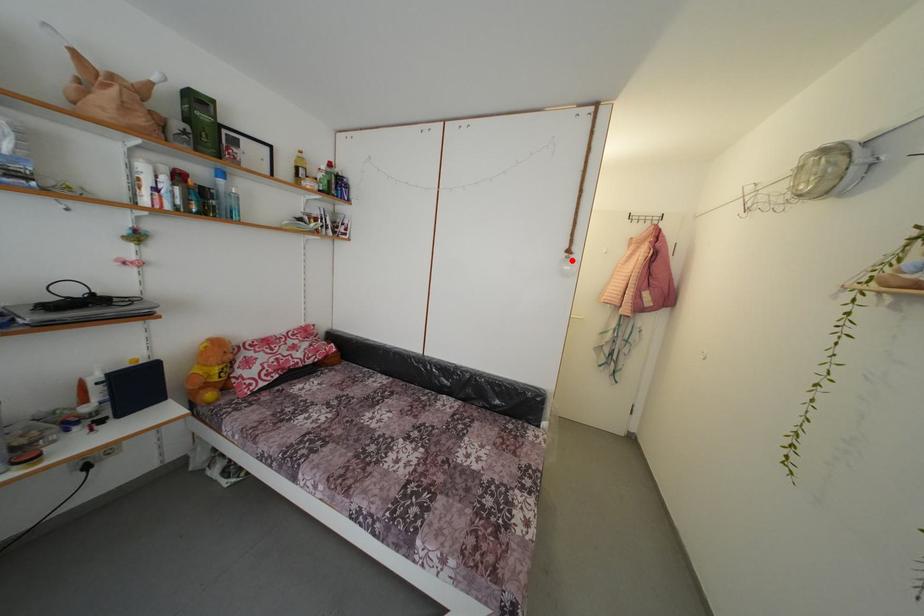
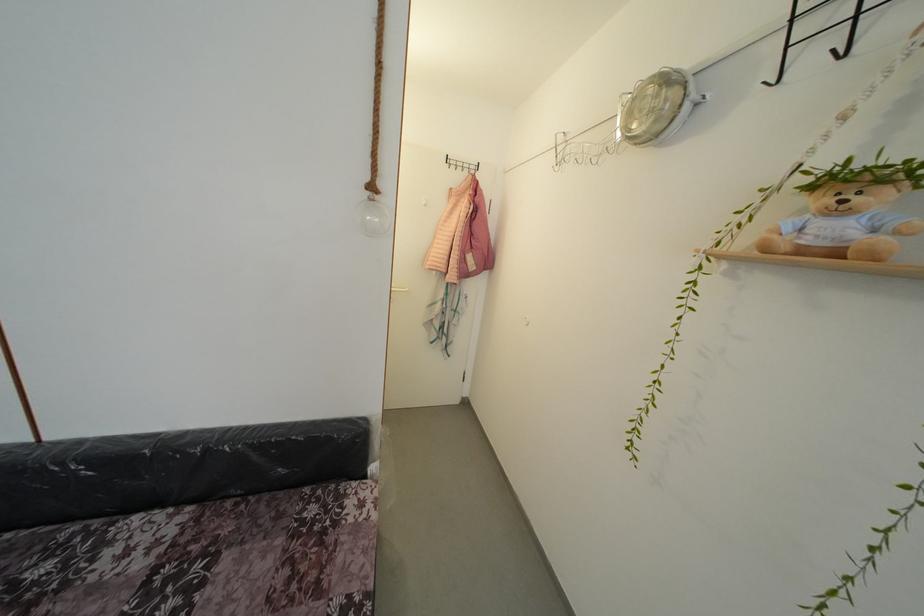
Find the pixel in the second image that matches the highlighted location in the first image.

(373, 199)